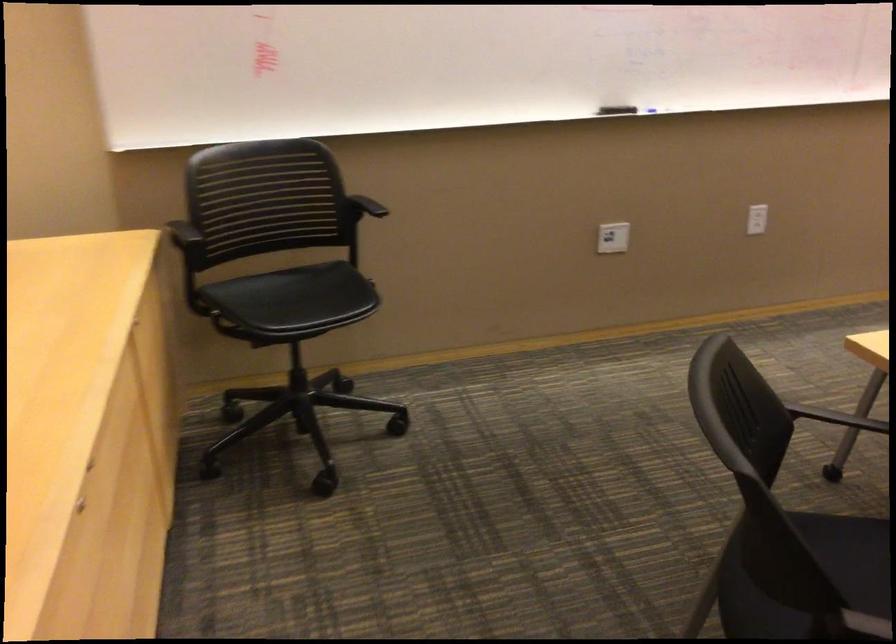
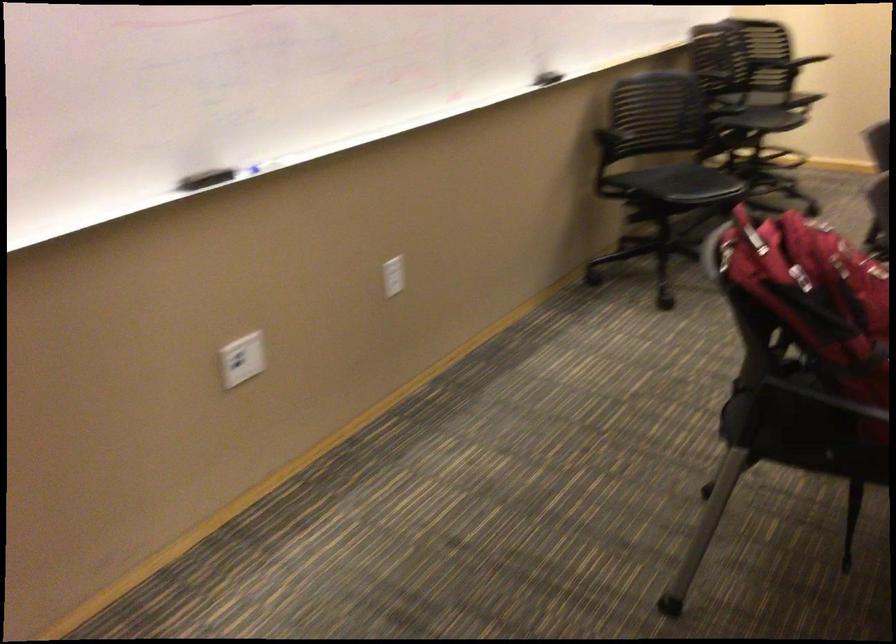
In the second image, find the point that corresponds to point 610,231 in the first image.

(242, 359)